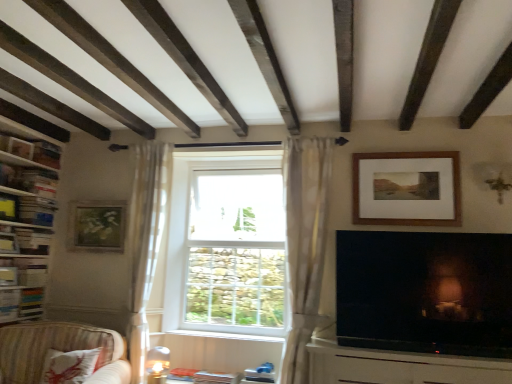
Question: From the image's perspective, relative to sheer white curtain at center, which is the 1th curtain in right-to-left order, is white glass window at center above or below?

Choices:
 (A) above
 (B) below

Answer: (B)

Question: Is white glass window at center in front of or behind sheer white curtain at center, positioned as the 2th curtain in left-to-right order, in the image?

Choices:
 (A) behind
 (B) front

Answer: (A)

Question: Which is nearer to the striped fabric couch at lower left?

Choices:
 (A) white sheer curtain at left, the 2th curtain positioned from the right
 (B) white painted wood at center
 (C) matte gold picture frame at left, arranged as the second picture frame when viewed from the right
 (D) wooden bookshelf at left, acting as the 2th shelf starting from the bottom
 (E) wooden frame at upper right, arranged as the second picture frame when viewed from the back

Answer: (A)

Question: Which is nearer to the striped fabric couch at lower left?

Choices:
 (A) matte black television at lower right
 (B) white glass window at center
 (C) sheer white curtain at center, positioned as the 2th curtain in left-to-right order
 (D) white sheer curtain at left, the 2th curtain positioned from the right
 (E) wooden bookshelf at left, acting as the 2th shelf starting from the bottom

Answer: (D)